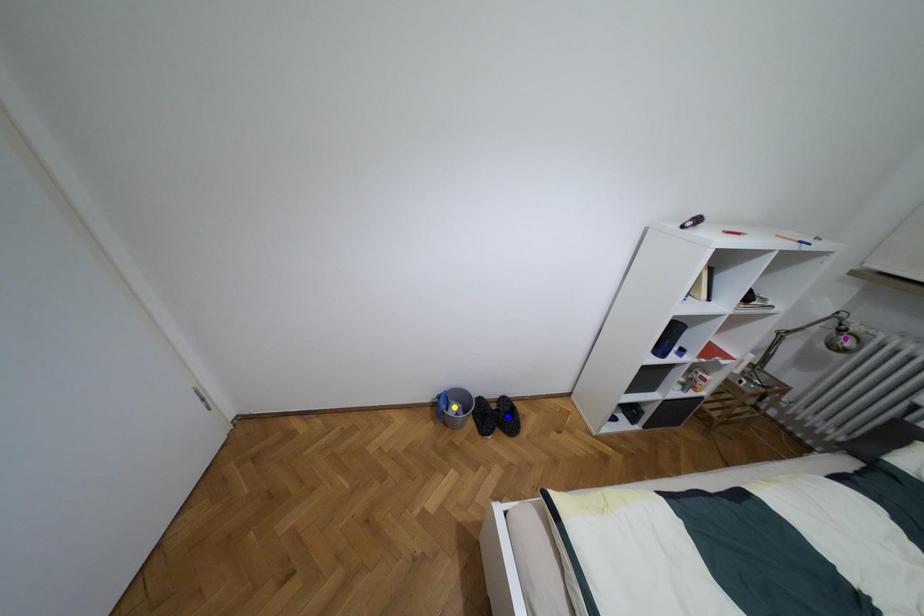
Order these from nearest to farthest:
yellow point | purple point | blue point

purple point < yellow point < blue point